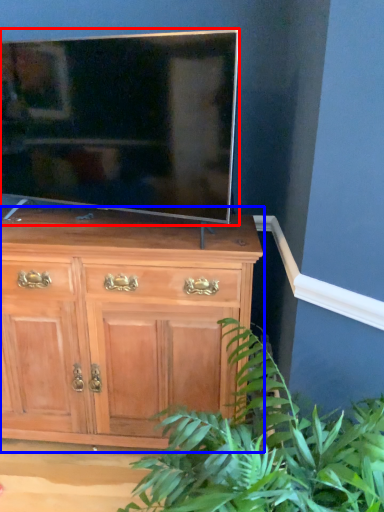
Question: Among these objects, which one is farthest to the camera, television (highlighted by a red box) or chest of drawers (highlighted by a blue box)?

Choices:
 (A) television
 (B) chest of drawers

Answer: (B)